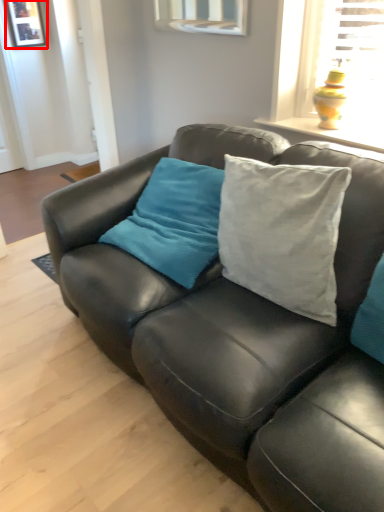
Question: From the image's perspective, what is the correct spatial positioning of picture frame (annotated by the red box) in reference to studio couch?

Choices:
 (A) below
 (B) above

Answer: (B)